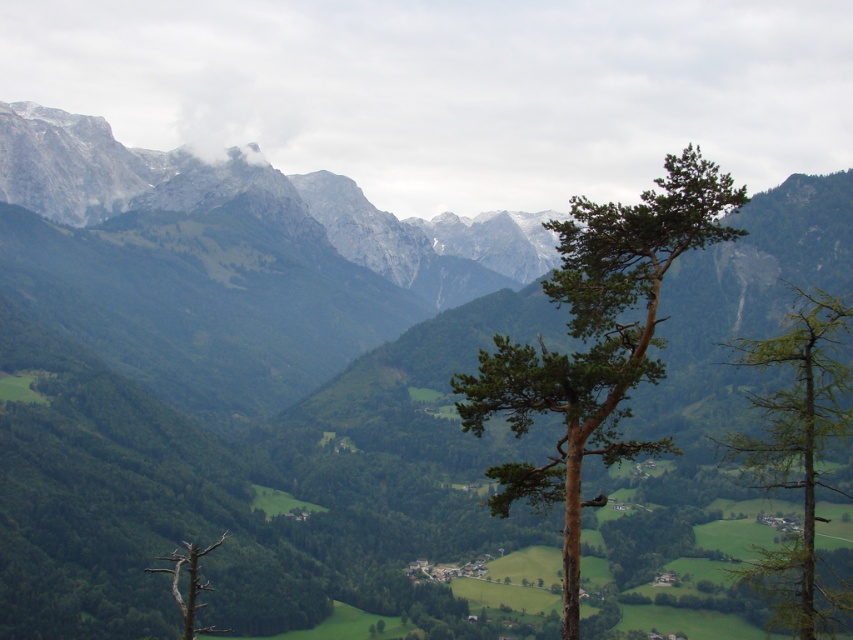
Is green rough bark tree at center shorter than green lacy tree at right?

No, green rough bark tree at center is not shorter than green lacy tree at right.

Is point (525, 472) positioned behind point (810, 320)?

No, it is in front of (810, 320).

Identify the location of green rough bark tree at center. This screenshot has width=853, height=640. (595, 342).

At what (x,y) coordinates should I click in order to perform the action: click on green rough bark tree at center. Please return your answer as a coordinate pair (x, y). Looking at the image, I should click on (595, 342).

Where is `green rough bark tree at center`? green rough bark tree at center is located at coordinates (595, 342).

Does green rough bark tree at center appear under brown deadwood at lower left?

Actually, green rough bark tree at center is above brown deadwood at lower left.

I want to click on green rough bark tree at center, so click(x=595, y=342).

This screenshot has width=853, height=640. What do you see at coordinates (798, 451) in the screenshot?
I see `green lacy tree at right` at bounding box center [798, 451].

Between green lacy tree at right and brown deadwood at lower left, which one has less height?

With less height is brown deadwood at lower left.

You are a GUI agent. You are given a task and a screenshot of the screen. Output one action in this format:
    pyautogui.click(x=<x>, y=<y>)
    Task: Click on the green lacy tree at right
    The width and height of the screenshot is (853, 640).
    Given the screenshot: What is the action you would take?
    pyautogui.click(x=798, y=451)